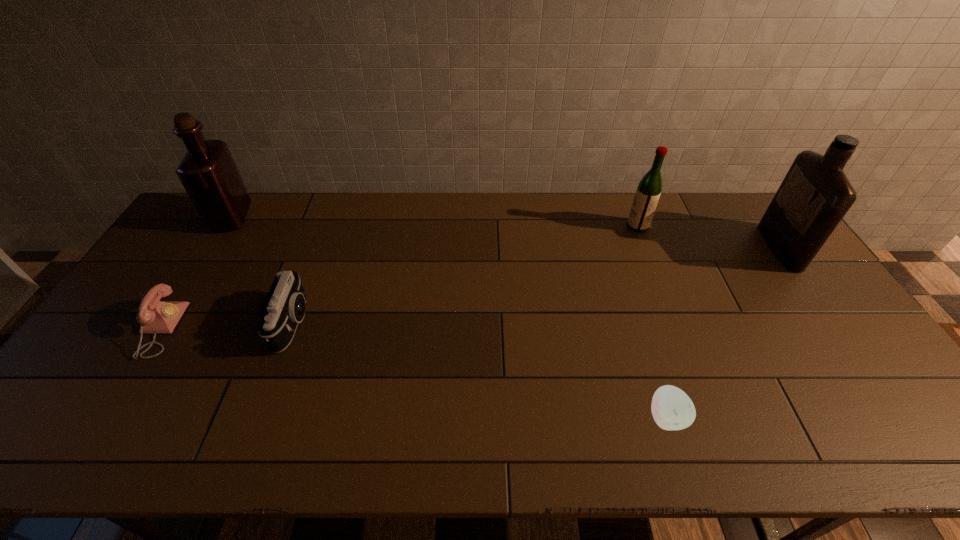
Locate an element on the screen. This screenshot has height=540, width=960. vacant area between the telephone and the fourth tallest object is located at coordinates (227, 326).

Locate an element on the screen. free space between the rightmost liquor and the third object from right to left is located at coordinates (723, 332).

At what (x,y) coordinates should I click in order to perform the action: click on free point between the third shortest object and the telephone. Please return your answer as a coordinate pair (x, y). The image size is (960, 540). Looking at the image, I should click on (227, 326).

The width and height of the screenshot is (960, 540). Identify the location of free space between the leftmost liquor and the telephone. (196, 273).

The image size is (960, 540). Identify the location of vacant region between the fourth tallest object and the leftmost liquor. (263, 270).

At what (x,y) coordinates should I click in order to perform the action: click on vacant area between the fourth shortest object and the third shortest object. Please return your answer as a coordinate pair (x, y). This screenshot has width=960, height=540. Looking at the image, I should click on (466, 274).

The height and width of the screenshot is (540, 960). In order to click on vacant space that's between the fourth tallest object and the rightmost liquor in this screenshot , I will do `click(537, 285)`.

Identify the location of free spot between the fourth tallest object and the rightmost object. The image size is (960, 540). (537, 285).

Locate an element on the screen. The width and height of the screenshot is (960, 540). vacant point located between the telephone and the third object from right to left is located at coordinates (413, 373).

Identify the location of vacant area between the nearest object and the rightmost object. (723, 332).